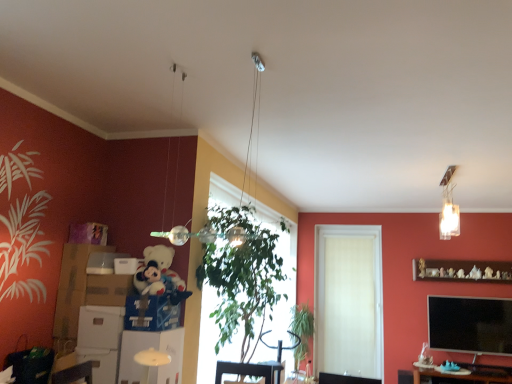
Question: Considering the positions of point (278, 342) and point (90, 307), is point (278, 342) closer or farther from the camera than point (90, 307)?

Choices:
 (A) farther
 (B) closer

Answer: (A)

Question: From a real-world perspective, is metallic silver swivel chair at center above or below white cardboard box at lower left, placed as the 3th cardboard box when sorted from right to left?

Choices:
 (A) above
 (B) below

Answer: (B)

Question: Estimate the real-world distances between objects in this image. Which object is closer to the white matte door at center?

Choices:
 (A) metallic silver swivel chair at center
 (B) green leafy plant at center
 (C) wooden shelf at upper right, which is counted as the first shelf, starting from the right
 (D) matte cardboard box at left, placed as the 2th box when sorted from top to bottom
 (E) green leafy plant at center

Answer: (B)

Question: Based on their relative distances, which object is farther from the green leafy plant at center?

Choices:
 (A) brown wooden table at lower right
 (B) white matte door at center
 (C) wooden shelf at upper right, which appears as the first shelf when viewed from the back
 (D) soft plush toy at left
 (E) green leafy plant at center

Answer: (D)